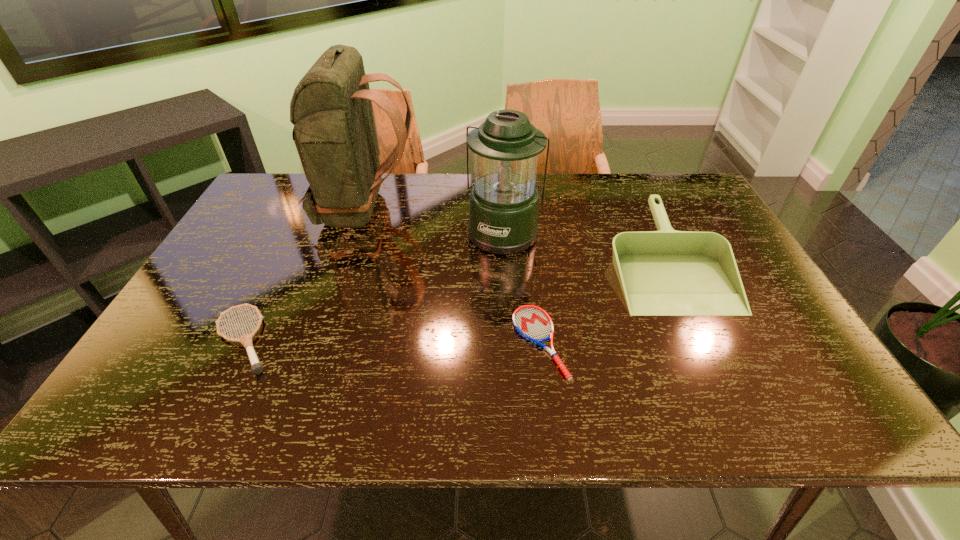
The image size is (960, 540). I want to click on the fourth closest object to the lantern, so click(246, 340).

Locate an element on the screen. This screenshot has width=960, height=540. vacant point that satisfies the following two spatial constraints: 1. on the back of the right tennis racket; 2. on the right side of the tallest object is located at coordinates (322, 342).

This screenshot has width=960, height=540. Find the location of `vacant region that satisfies the following two spatial constraints: 1. on the back of the shortest object; 2. on the left side of the backpack`. vacant region that satisfies the following two spatial constraints: 1. on the back of the shortest object; 2. on the left side of the backpack is located at coordinates (322, 342).

Locate an element on the screen. This screenshot has width=960, height=540. free location that satisfies the following two spatial constraints: 1. on the back of the right tennis racket; 2. on the left side of the tallest object is located at coordinates (322, 342).

Identify the location of vacant space that satisfies the following two spatial constraints: 1. on the back of the tallest object; 2. on the left side of the shorter tennis racket. (322, 342).

Identify the location of vacant space that satisfies the following two spatial constraints: 1. on the back of the tallest object; 2. on the right side of the right tennis racket. (322, 342).